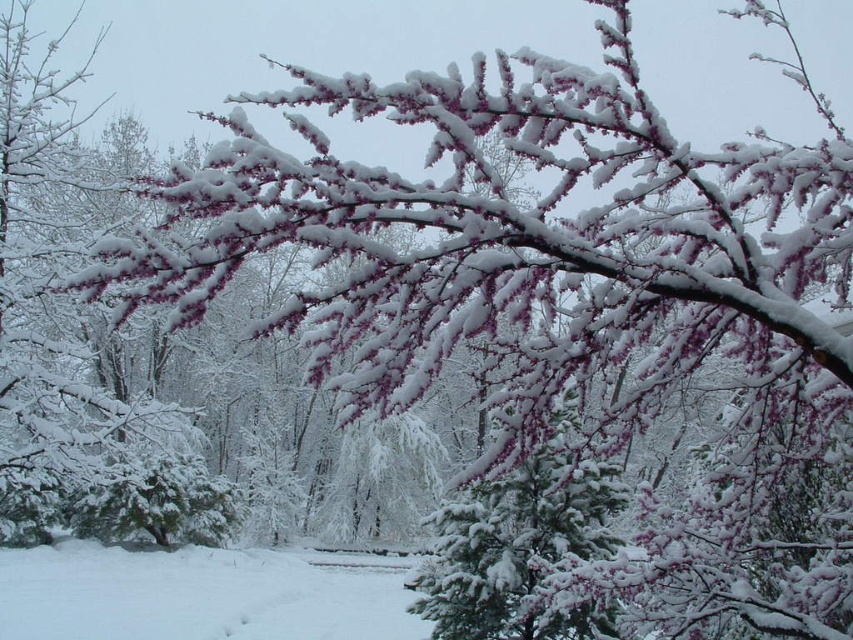
You are standing in the winter scene and want to place a small decoration between the two points, point (24, 556) and point (451, 579). Which point is closer to you so you can start placing the decoration from there?

Point (24, 556) is closer to you than point (451, 579), so you should start placing the decoration from point (24, 556).